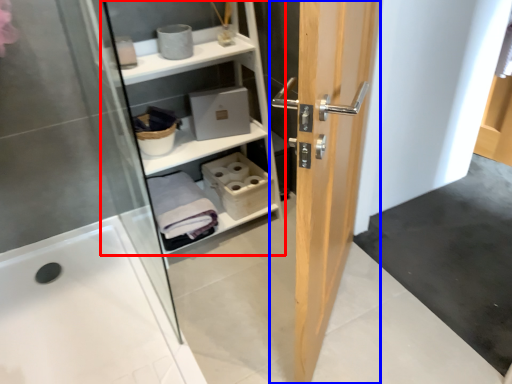
Question: Which object appears farthest to the camera in this image, shelf (highlighted by a red box) or door (highlighted by a blue box)?

Choices:
 (A) shelf
 (B) door

Answer: (A)